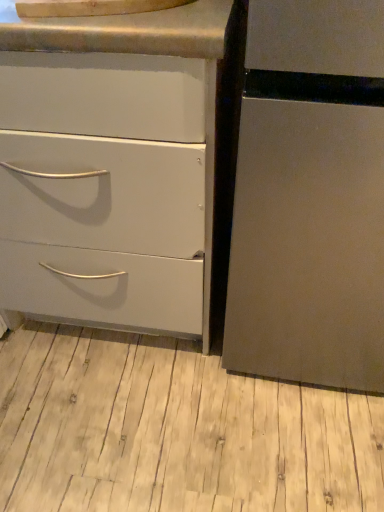
Question: Is matte white drawer at left wider than brushed metal counter top at upper center?

Choices:
 (A) no
 (B) yes

Answer: (B)

Question: Is matte white drawer at left turned away from brushed metal counter top at upper center?

Choices:
 (A) no
 (B) yes

Answer: (A)

Question: Is brushed metal counter top at upper center surrounded by matte white drawer at left?

Choices:
 (A) yes
 (B) no

Answer: (B)

Question: From a real-world perspective, is matte white drawer at left physically above brushed metal counter top at upper center?

Choices:
 (A) no
 (B) yes

Answer: (A)

Question: From the image's perspective, is matte white drawer at left on brushed metal counter top at upper center?

Choices:
 (A) no
 (B) yes

Answer: (A)

Question: Relative to brushed metal counter top at upper center, is matte white drawer at left in front or behind?

Choices:
 (A) front
 (B) behind

Answer: (A)

Question: Choose the correct answer: Is matte white drawer at left inside brushed metal counter top at upper center or outside it?

Choices:
 (A) outside
 (B) inside

Answer: (A)

Question: Is matte white drawer at left wider or thinner than brushed metal counter top at upper center?

Choices:
 (A) wide
 (B) thin

Answer: (A)

Question: In terms of size, does matte white drawer at left appear bigger or smaller than brushed metal counter top at upper center?

Choices:
 (A) small
 (B) big

Answer: (B)

Question: From the image's perspective, is light wood floor at lower center positioned above or below brushed metal counter top at upper center?

Choices:
 (A) above
 (B) below

Answer: (B)

Question: Considering the positions of light wood floor at lower center and brushed metal counter top at upper center in the image, is light wood floor at lower center wider or thinner than brushed metal counter top at upper center?

Choices:
 (A) thin
 (B) wide

Answer: (B)

Question: In terms of size, does light wood floor at lower center appear bigger or smaller than brushed metal counter top at upper center?

Choices:
 (A) small
 (B) big

Answer: (B)

Question: In terms of height, does light wood floor at lower center look taller or shorter compared to brushed metal counter top at upper center?

Choices:
 (A) tall
 (B) short

Answer: (A)

Question: From a real-world perspective, relative to light wood floor at lower center, is matte white drawer at left vertically above or below?

Choices:
 (A) below
 (B) above

Answer: (B)

Question: In terms of size, does matte white drawer at left appear bigger or smaller than light wood floor at lower center?

Choices:
 (A) small
 (B) big

Answer: (B)